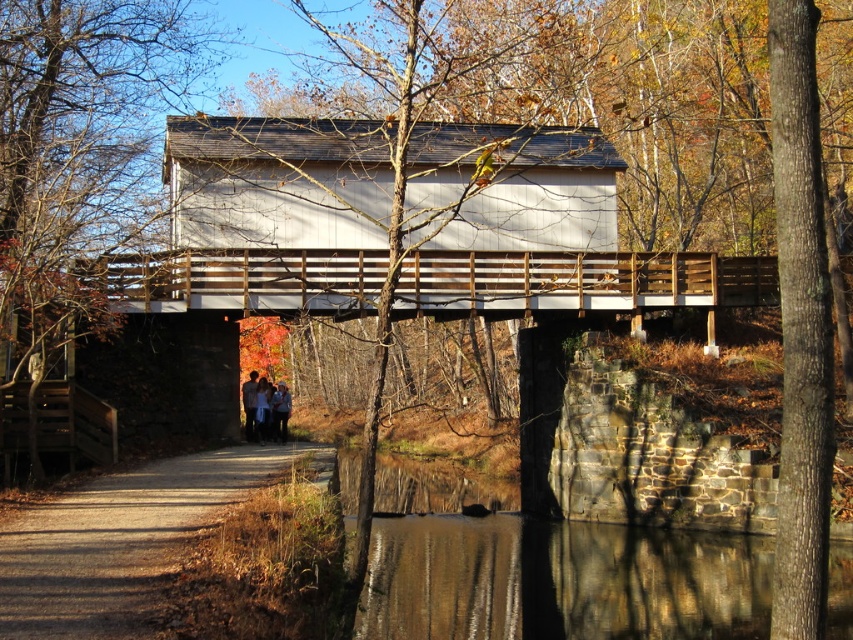
You are standing on the covered bridge and see the blue jeans at center. If you walk straight ahead, will you reach the end of the bridge before the blue jeans?

The blue jeans at center are located at point (260, 406), so if you walk straight ahead from your current position, you will reach the end of the bridge before the blue jeans.